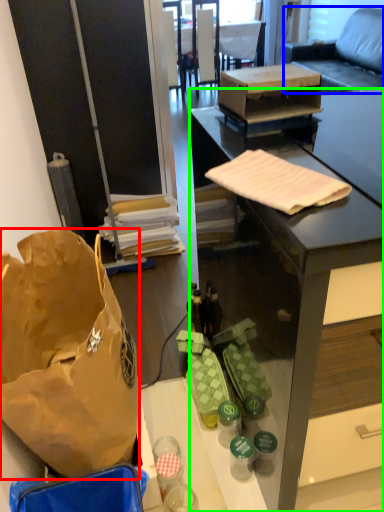
Question: Estimate the real-world distances between objects in this image. Which object is farther from handbag (highlighted by a red box), studio couch (highlighted by a blue box) or desk (highlighted by a green box)?

Choices:
 (A) studio couch
 (B) desk

Answer: (A)